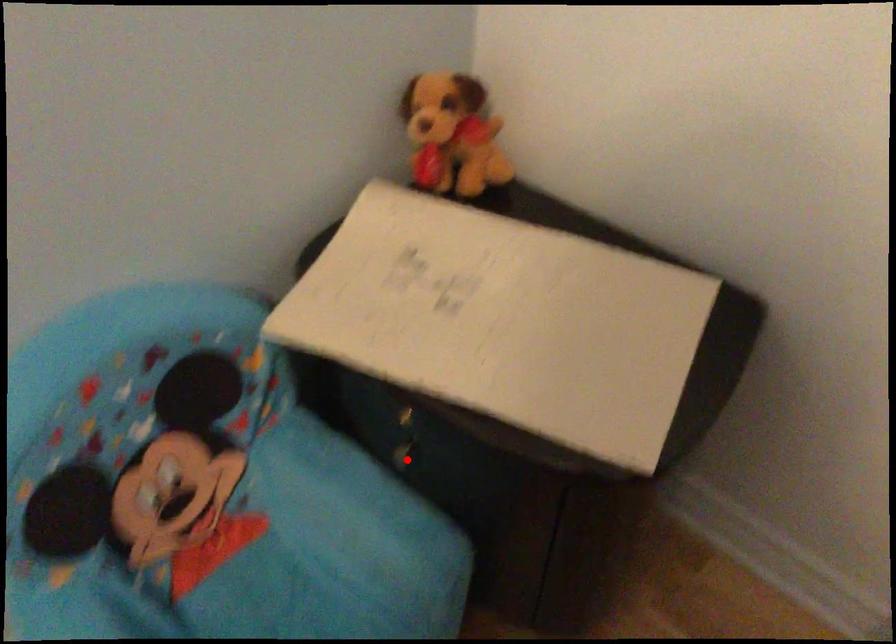
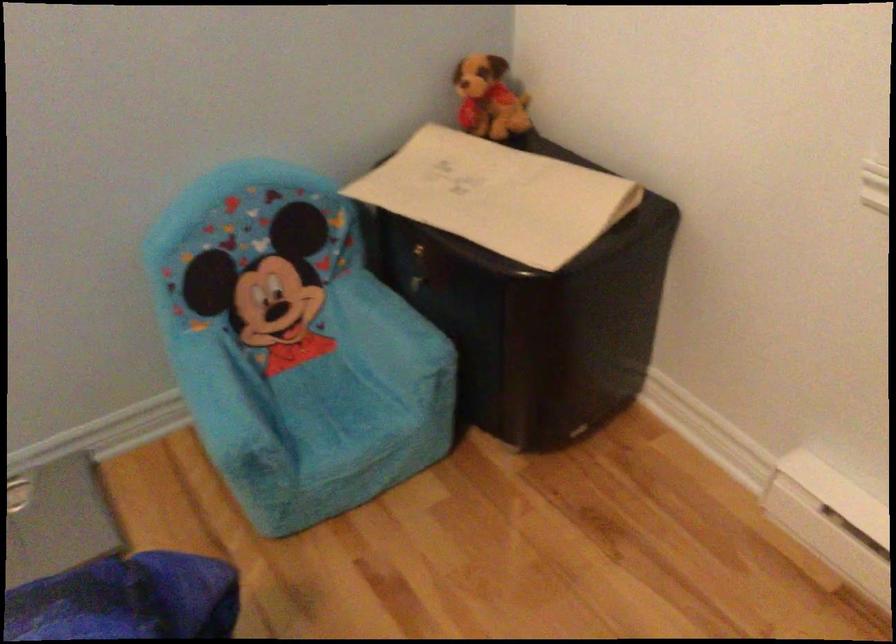
In the second image, find the point that corresponds to the highlighted location in the first image.

(419, 292)